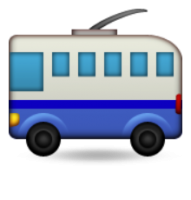
You are a GUI agent. You are given a task and a screenshot of the screen. Output one action in this format:
    pyautogui.click(x=<x>, y=<y>)
    Task: Click on the front window
    This screenshot has height=200, width=191.
    Given the screenshot: What is the action you would take?
    pyautogui.click(x=33, y=71)